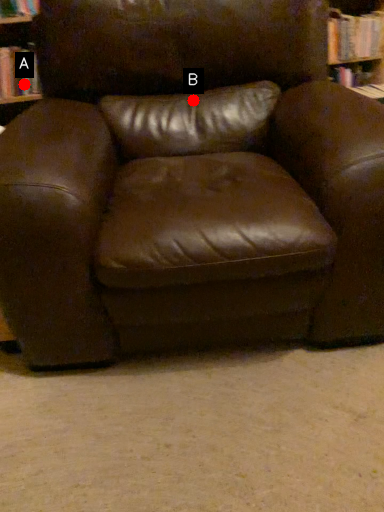
Question: Two points are circled on the image, labeled by A and B beside each circle. Which of the following is the closest to the observer?

Choices:
 (A) A is closer
 (B) B is closer

Answer: (B)